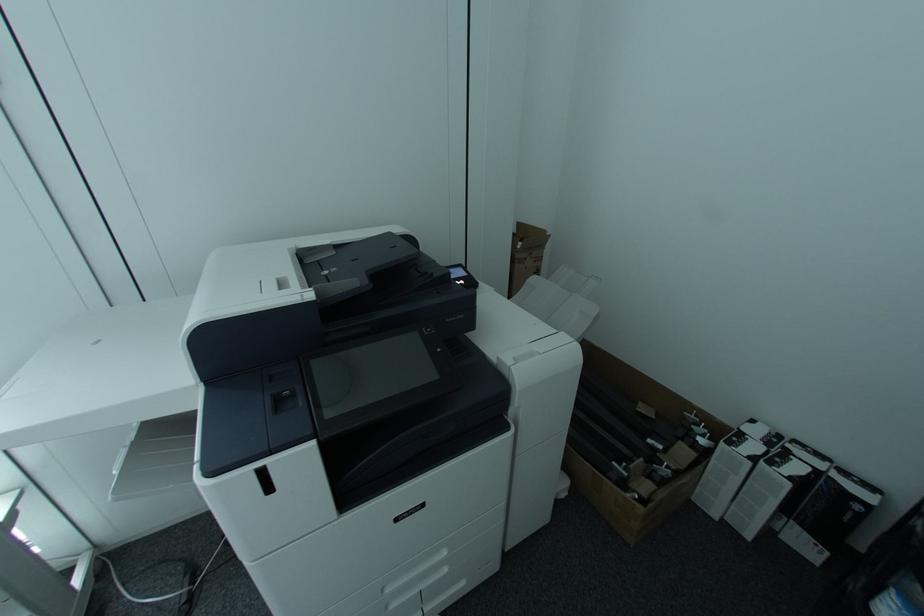
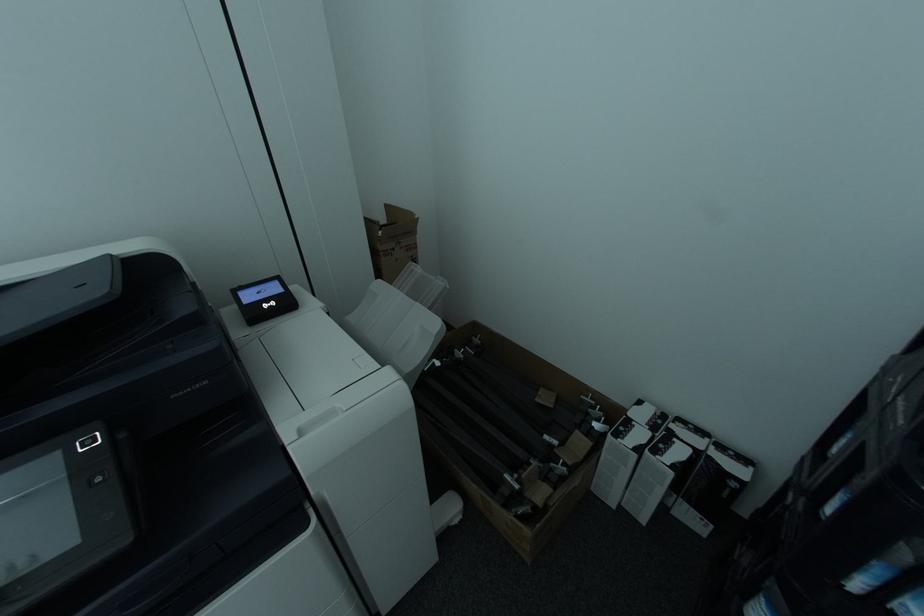
Which direction would the cameraman need to move to produce the second image?

The cameraman walked toward right, forward.